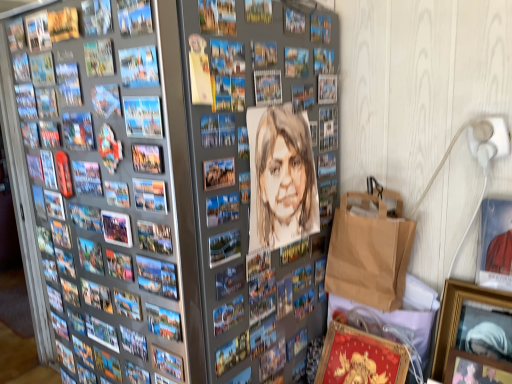
Question: In the image, is brown paper bag at lower right positioned in front of or behind matte paper comic book at center, positioned as the fourth comic book in right-to-left order?

Choices:
 (A) front
 (B) behind

Answer: (B)

Question: From a real-world perspective, is brown paper bag at lower right physically located above or below matte paper comic book at center, placed as the first comic book when sorted from back to front?

Choices:
 (A) below
 (B) above

Answer: (A)

Question: Which object is positioned closest to the matte paper comic book at upper left, which ranks as the third comic book in left-to-right order?

Choices:
 (A) blue paper comic book at upper left, the 3th comic book in the front-to-back sequence
 (B) wooden picture frame at lower right, which appears as the 4th picture frame when viewed from the left
 (C) metallic silver picture frame at center, which appears as the sixth picture frame when viewed from the right
 (D) metallic silver picture frame at center, acting as the third picture frame starting from the left
 (E) matte paper comic book at center, placed as the fourth comic book when sorted from front to back

Answer: (A)

Question: Which object is positioned closest to the matte paper comic book at center, placed as the first comic book when sorted from back to front?

Choices:
 (A) blue paper comic book at upper left, the 3th comic book in the front-to-back sequence
 (B) wooden picture frame at lower right, which appears as the 4th picture frame when viewed from the left
 (C) metallic silver picture frame at center, arranged as the first picture frame when viewed from the left
 (D) metallic silver picture frame at center, acting as the third picture frame starting from the left
 (E) matte paper comic book at upper left, the 3th comic book when ordered from back to front

Answer: (A)